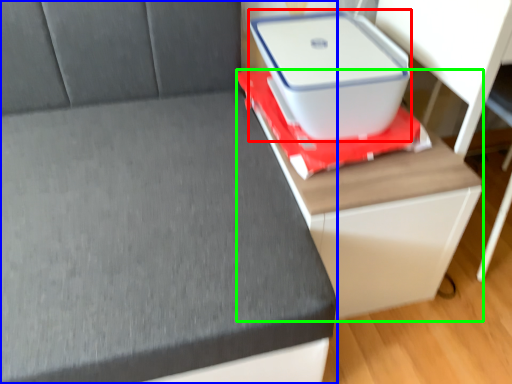
Question: Which object is positioned farthest from storage box (highlighted by a red box)? Select from furniture (highlighted by a blue box) and table (highlighted by a green box).

Choices:
 (A) furniture
 (B) table

Answer: (A)